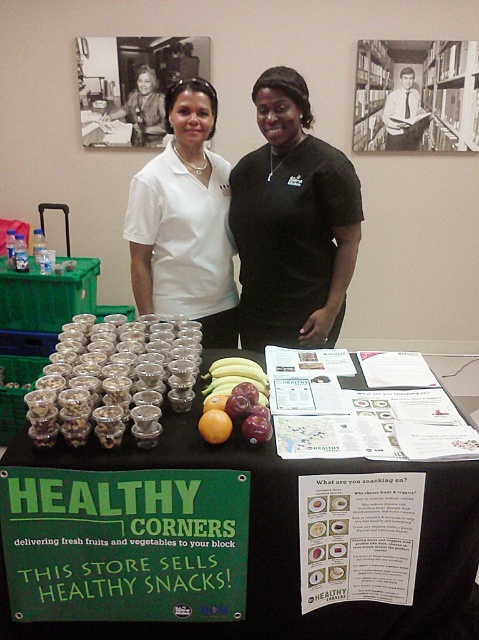
You are organizing a health fair and need to place a 1.2 meter wide banner between the metallic silver bookshelf at upper right and the shiny red apples at center. Can the banner fit between them?

The metallic silver bookshelf at upper right is wider than the shiny red apples at center. Since the banner is 1.2 meters wide, it might not fit if the space between them is narrower than 1.2 meters. However, the description only states the bookshelf is wider, not the exact distance between them. Without knowing the actual spacing, we cannot confirm if the banner will fit.

You are a customer at the event and want to place a small gift box between the white smooth shirt at center and the shiny red apples at center. Which object should you place it closer to if the gift box is narrower than the apples?

The white smooth shirt at center is wider than the shiny red apples at center. Since the gift box is narrower than the apples, you should place it closer to the shiny red apples at center to ensure it fits within the available space.